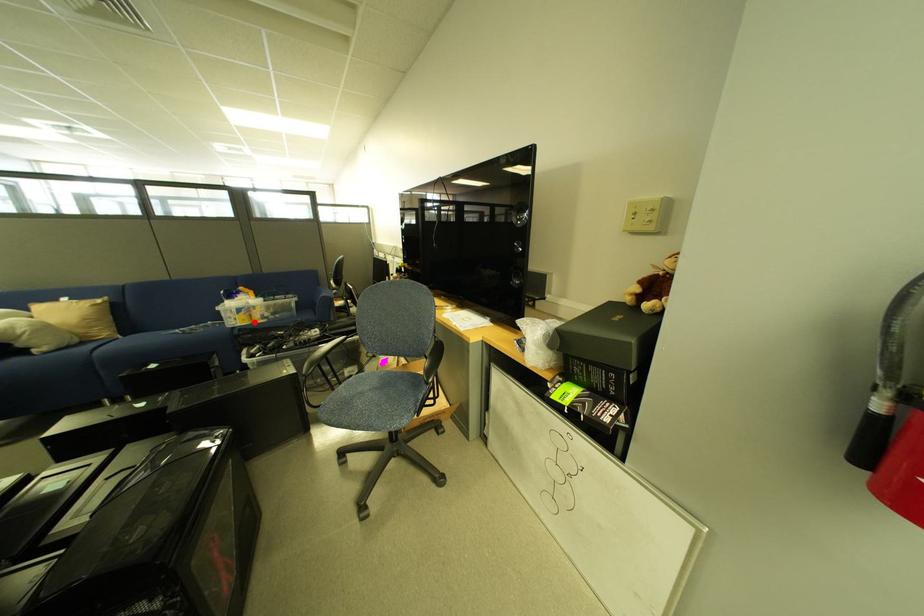
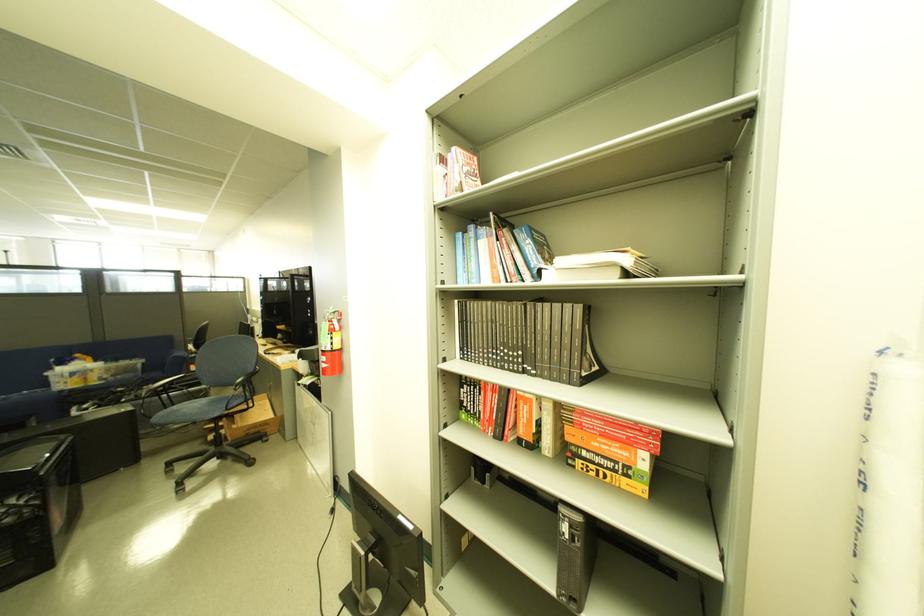
The point at the highlighted location is marked in the first image. Where is the corresponding point in the second image?

(88, 385)